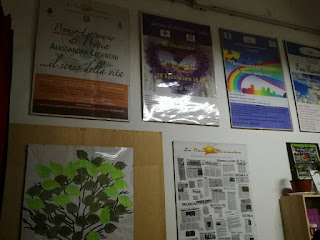
Locate an element on the screen. This screenshot has height=240, width=320. brown backing for poster is located at coordinates (146, 152).